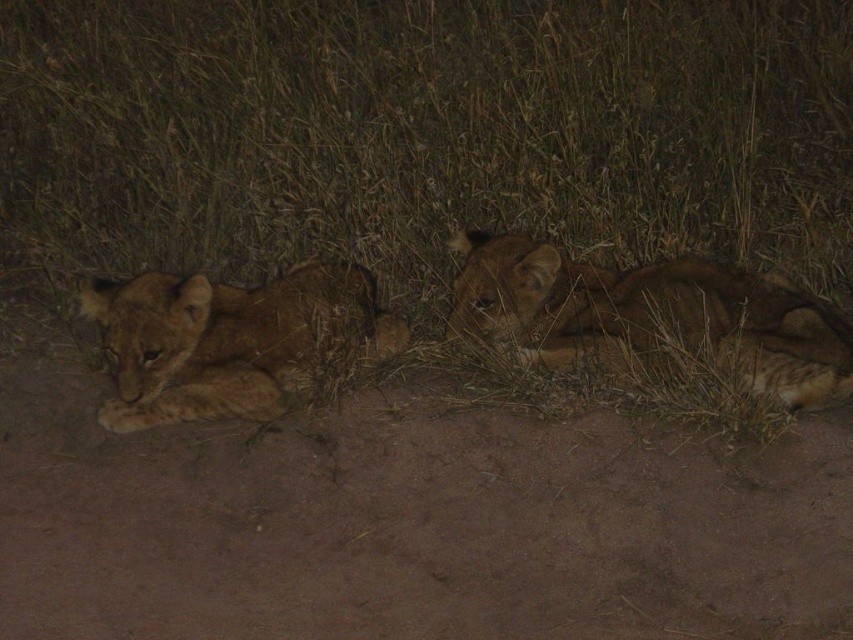
Question: Is golden fur lion cub at center to the right of golden fur lion cub at left from the viewer's perspective?

Choices:
 (A) yes
 (B) no

Answer: (A)

Question: Among these objects, which one is nearest to the camera?

Choices:
 (A) golden fur lion cub at left
 (B) golden fur lion cub at center

Answer: (A)

Question: Which point appears closest to the camera in this image?

Choices:
 (A) (193, 316)
 (B) (776, 333)

Answer: (A)

Question: Is golden fur lion cub at center to the right of golden fur lion cub at left from the viewer's perspective?

Choices:
 (A) no
 (B) yes

Answer: (B)

Question: Is golden fur lion cub at center in front of golden fur lion cub at left?

Choices:
 (A) yes
 (B) no

Answer: (B)